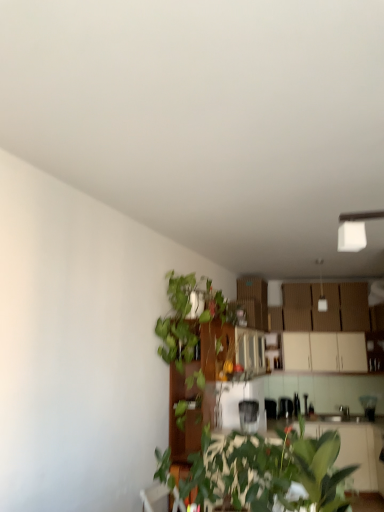
At what (x,y) coordinates should I click in order to perform the action: click on satin silver toaster at center, which ranks as the 1th appliance in top-to-bottom order. Please return your answer as a coordinate pair (x, y). Image resolution: width=384 pixels, height=512 pixels. Looking at the image, I should click on (249, 415).

Find the location of a particular element. This screenshot has width=384, height=512. green leafy plant at center is located at coordinates (190, 356).

Describe the element at coordinates (238, 368) in the screenshot. I see `green matte plant at center` at that location.

The image size is (384, 512). Describe the element at coordinates (324, 352) in the screenshot. I see `white matte cabinet at upper right` at that location.

This screenshot has width=384, height=512. What do you see at coordinates (268, 471) in the screenshot?
I see `green leafy plant at lower center` at bounding box center [268, 471].

The width and height of the screenshot is (384, 512). Describe the element at coordinates (285, 407) in the screenshot. I see `metallic silver toaster at center, which is counted as the first appliance, starting from the back` at that location.

Find the location of a particular element. satin silver toaster at center, which ranks as the 1th appliance in top-to-bottom order is located at coordinates (249, 415).

Is green leafy plant at lower center facing away from green matte plant at center?

green leafy plant at lower center does not have its back to green matte plant at center.

From a real-world perspective, is green leafy plant at lower center physically located above or below green matte plant at center?

In terms of real-world spatial position, green leafy plant at lower center is below green matte plant at center.

The image size is (384, 512). I want to click on houseplant that appears in front of the green matte plant at center, so click(268, 471).

Based on the photo, which point is more distant from viewer, (321, 473) or (237, 371)?

Positioned behind is point (237, 371).

Is green leafy plant at center oriented away from white matte cabinet at upper right?

green leafy plant at center does not have its back to white matte cabinet at upper right.

Is green leafy plant at center taller or shorter than white matte cabinet at upper right?

Clearly, green leafy plant at center is taller compared to white matte cabinet at upper right.

Which is correct: green leafy plant at center is inside white matte cabinet at upper right, or outside of it?

green leafy plant at center exists outside the volume of white matte cabinet at upper right.

From their relative heights in the image, would you say satin silver toaster at center, acting as the 1th appliance starting from the left, is taller or shorter than green leafy plant at lower center?

Considering their sizes, satin silver toaster at center, acting as the 1th appliance starting from the left, has less height than green leafy plant at lower center.

Locate an element on the screen. This screenshot has height=512, width=384. houseplant above the satin silver toaster at center, marked as the third appliance in a right-to-left arrangement (from the image's perspective) is located at coordinates (268, 471).

Does satin silver toaster at center, which ranks as the 1th appliance in top-to-bottom order, have a greater width compared to green leafy plant at lower center?

In fact, satin silver toaster at center, which ranks as the 1th appliance in top-to-bottom order, might be narrower than green leafy plant at lower center.

From a real-world perspective, is satin silver toaster at center, which is counted as the 3th appliance, starting from the bottom, over green leafy plant at lower center?

No, from a real-world perspective, satin silver toaster at center, which is counted as the 3th appliance, starting from the bottom, is not on top of green leafy plant at lower center.

Locate an element on the screen. cabinetry on the left of metallic silver kettle at center, which ranks as the first appliance in right-to-left order is located at coordinates (324, 352).

Who is smaller, white matte cabinet at upper right or metallic silver kettle at center, positioned as the 2th appliance in back-to-front order?

With smaller size is metallic silver kettle at center, positioned as the 2th appliance in back-to-front order.

From the image's perspective, which is above, white matte cabinet at upper right or metallic silver kettle at center, which ranks as the first appliance in right-to-left order?

white matte cabinet at upper right.

Is white matte cabinet at upper right at the right side of metallic silver kettle at center, arranged as the 3th appliance when viewed from the left?

No, white matte cabinet at upper right is not to the right of metallic silver kettle at center, arranged as the 3th appliance when viewed from the left.

In terms of size, does metallic silver toaster at center, which is the second appliance from left to right, appear bigger or smaller than green matte plant at center?

In the image, metallic silver toaster at center, which is the second appliance from left to right, appears to be larger than green matte plant at center.

Could you measure the distance between metallic silver toaster at center, which is the second appliance from left to right, and green matte plant at center?

A distance of 19.89 inches exists between metallic silver toaster at center, which is the second appliance from left to right, and green matte plant at center.

Can you tell me how much metallic silver toaster at center, the 2th appliance in the right-to-left sequence, and green matte plant at center differ in facing direction?

They differ by 76.1 degrees in their facing directions.

Is metallic silver toaster at center, the 3th appliance from the top, directly adjacent to green matte plant at center?

metallic silver toaster at center, the 3th appliance from the top, is not next to green matte plant at center, and they're not touching.

You are a GUI agent. You are given a task and a screenshot of the screen. Output one action in this format:
    pyautogui.click(x=<x>, y=<y>)
    Task: Click on the houseplant to the right of green leafy plant at center
    This screenshot has height=512, width=384.
    Given the screenshot: What is the action you would take?
    pyautogui.click(x=268, y=471)

Does green leafy plant at lower center have a lesser height compared to green leafy plant at center?

Yes, green leafy plant at lower center is shorter than green leafy plant at center.

Considering the relative sizes of green leafy plant at lower center and green leafy plant at center in the image provided, is green leafy plant at lower center bigger than green leafy plant at center?

No.

From a real-world perspective, is metallic silver toaster at center, the 2th appliance in the right-to-left sequence, under green leafy plant at center?

Yes, from a real-world perspective, metallic silver toaster at center, the 2th appliance in the right-to-left sequence, is beneath green leafy plant at center.

Is metallic silver toaster at center, the 3th appliance from the top, to the left of green leafy plant at center from the viewer's perspective?

In fact, metallic silver toaster at center, the 3th appliance from the top, is to the right of green leafy plant at center.

Is metallic silver toaster at center, which ranks as the 1th appliance in bottom-to-top order, surrounding green leafy plant at center?

No, metallic silver toaster at center, which ranks as the 1th appliance in bottom-to-top order, does not contain green leafy plant at center.

Can you see metallic silver toaster at center, which is the second appliance from left to right, touching green leafy plant at center?

metallic silver toaster at center, which is the second appliance from left to right, is not next to green leafy plant at center, and they're not touching.

Where is `flower below the green leafy plant at lower center (from the image's perspective)`? The image size is (384, 512). flower below the green leafy plant at lower center (from the image's perspective) is located at coordinates (238, 368).

Image resolution: width=384 pixels, height=512 pixels. What are the coordinates of `vegetation located in front of the white matte cabinet at upper right` in the screenshot? It's located at [190, 356].

Based on their spatial positions, is green leafy plant at center or green leafy plant at lower center further from metallic silver kettle at center, which ranks as the first appliance in right-to-left order?

Based on the image, green leafy plant at lower center appears to be further to metallic silver kettle at center, which ranks as the first appliance in right-to-left order.

Looking at the image, which one is located closer to satin silver toaster at center, marked as the third appliance in a back-to-front arrangement, metallic silver toaster at center, which ranks as the 1th appliance in bottom-to-top order, or green leafy plant at center?

metallic silver toaster at center, which ranks as the 1th appliance in bottom-to-top order, is closer to satin silver toaster at center, marked as the third appliance in a back-to-front arrangement.

Estimate the real-world distances between objects in this image. Which object is further from satin silver toaster at center, marked as the third appliance in a back-to-front arrangement, green leafy plant at lower center or green matte plant at center?

green leafy plant at lower center is further to satin silver toaster at center, marked as the third appliance in a back-to-front arrangement.

Which object lies nearer to the anchor point satin silver toaster at center, which is counted as the 3th appliance, starting from the bottom, metallic silver kettle at center, marked as the 2th appliance in a bottom-to-top arrangement, or green leafy plant at center?

green leafy plant at center is positioned closer to the anchor satin silver toaster at center, which is counted as the 3th appliance, starting from the bottom.

Estimate the real-world distances between objects in this image. Which object is closer to metallic silver toaster at center, the 3th appliance from the top, white matte cabinet at upper right or metallic silver kettle at center, arranged as the 3th appliance when viewed from the left?

white matte cabinet at upper right lies closer to metallic silver toaster at center, the 3th appliance from the top, than the other object.

When comparing their distances from green leafy plant at lower center, does metallic silver toaster at center, which is counted as the first appliance, starting from the back, or green matte plant at center seem further?

green matte plant at center lies further to green leafy plant at lower center than the other object.

From the image, which object appears to be farther from metallic silver kettle at center, placed as the 2th appliance when sorted from top to bottom, white matte cabinet at upper right or green matte plant at center?

green matte plant at center is further to metallic silver kettle at center, placed as the 2th appliance when sorted from top to bottom.

From the image, which object appears to be nearer to metallic silver toaster at center, which is counted as the first appliance, starting from the back, green leafy plant at center or green leafy plant at lower center?

green leafy plant at center lies closer to metallic silver toaster at center, which is counted as the first appliance, starting from the back, than the other object.

Where is `flower between satin silver toaster at center, which is counted as the 3th appliance, starting from the bottom, and metallic silver kettle at center, the second appliance when ordered from front to back, in the front-back direction`? This screenshot has height=512, width=384. flower between satin silver toaster at center, which is counted as the 3th appliance, starting from the bottom, and metallic silver kettle at center, the second appliance when ordered from front to back, in the front-back direction is located at coordinates (238, 368).

Find the location of a particular element. Image resolution: width=384 pixels, height=512 pixels. cabinetry situated between green matte plant at center and metallic silver kettle at center, positioned as the 2th appliance in back-to-front order, from left to right is located at coordinates (324, 352).

You are a GUI agent. You are given a task and a screenshot of the screen. Output one action in this format:
    pyautogui.click(x=<x>, y=<y>)
    Task: Click on the cabinetry between metallic silver toaster at center, the 2th appliance in the right-to-left sequence, and metallic silver kettle at center, positioned as the 2th appliance in back-to-front order
    This screenshot has height=512, width=384.
    Given the screenshot: What is the action you would take?
    pyautogui.click(x=324, y=352)

Locate an element on the screen. This screenshot has height=512, width=384. cabinetry located between green leafy plant at lower center and metallic silver toaster at center, which ranks as the third appliance in front-to-back order, in the depth direction is located at coordinates (324, 352).